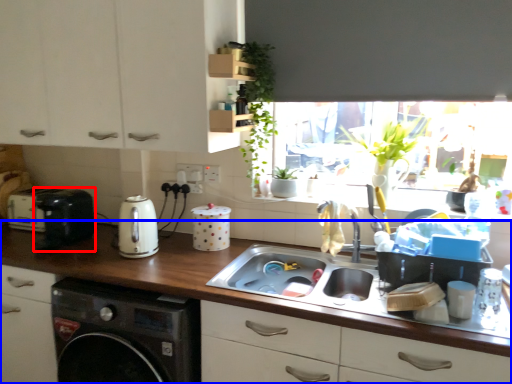
Question: Which of the following is the closest to the observer, appliance (highlighted by a red box) or countertop (highlighted by a blue box)?

Choices:
 (A) appliance
 (B) countertop

Answer: (B)